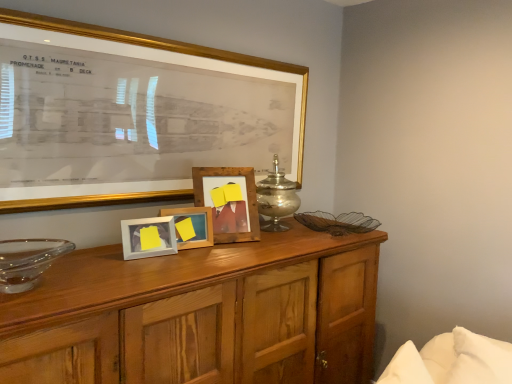
You are a GUI agent. You are given a task and a screenshot of the screen. Output one action in this format:
    pyautogui.click(x=<x>, y=<y>)
    Task: Click on the vacant area on the back side of transparent glass bowl at left
    The width and height of the screenshot is (512, 384).
    Given the screenshot: What is the action you would take?
    pyautogui.click(x=74, y=257)